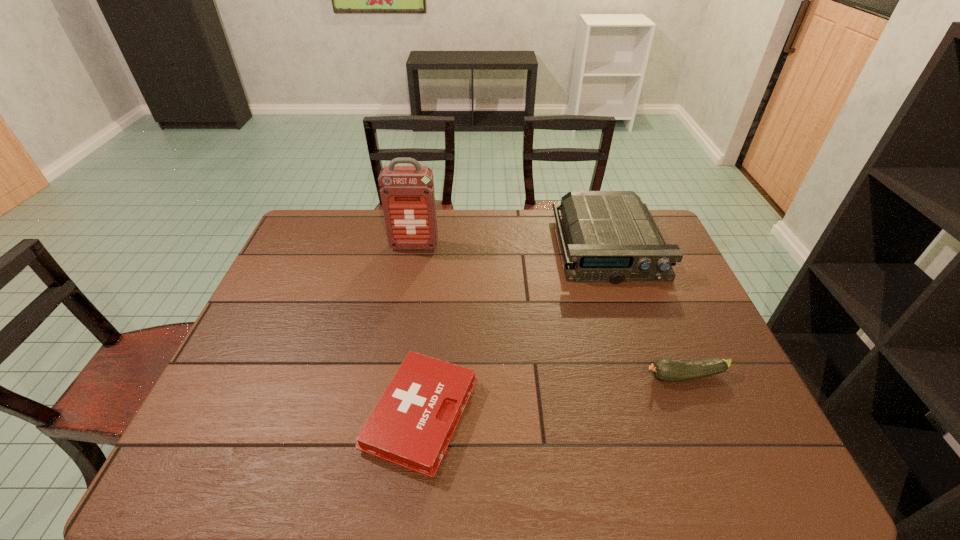
Where is `empty space between the zucchini and the nearer first-aid kit`? empty space between the zucchini and the nearer first-aid kit is located at coordinates (553, 395).

You are a GUI agent. You are given a task and a screenshot of the screen. Output one action in this format:
    pyautogui.click(x=<x>, y=<y>)
    Task: Click on the free point between the nearer first-aid kit and the zucchini
    
    Given the screenshot: What is the action you would take?
    pyautogui.click(x=553, y=395)

You are a GUI agent. You are given a task and a screenshot of the screen. Output one action in this format:
    pyautogui.click(x=<x>, y=<y>)
    Task: Click on the free spot between the radio receiver and the farther first-aid kit
    This screenshot has width=960, height=540.
    Given the screenshot: What is the action you would take?
    pyautogui.click(x=511, y=246)

I want to click on empty location between the zucchini and the second tallest object, so click(x=647, y=312).

Locate an element on the screen. object that stands as the third closest to the zucchini is located at coordinates (407, 193).

What are the coordinates of `object that is the closest to the zucchini` in the screenshot? It's located at (612, 237).

Find the location of `free space that satisfies the following two spatial constraints: 1. on the front-facing side of the farther first-aid kit; 2. on the right side of the nearer first-aid kit`. free space that satisfies the following two spatial constraints: 1. on the front-facing side of the farther first-aid kit; 2. on the right side of the nearer first-aid kit is located at coordinates (384, 415).